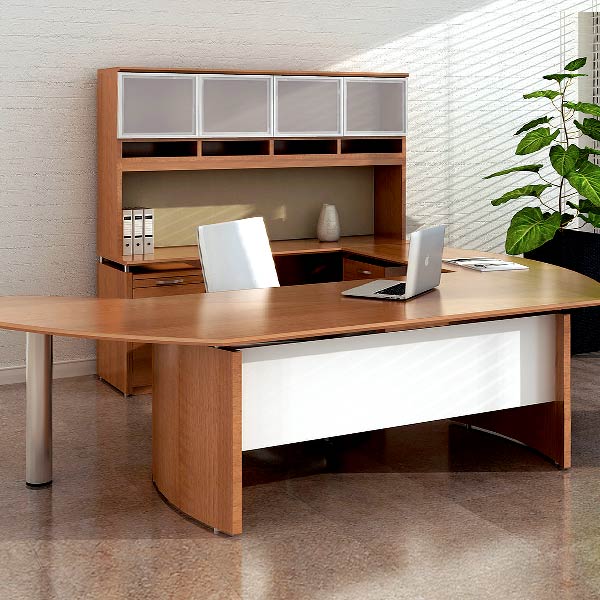
At what (x,y) coordinates should I click in order to perform the action: click on top drawer. Please return your answer as a coordinate pair (x, y). This screenshot has width=600, height=600. Looking at the image, I should click on (353, 269).